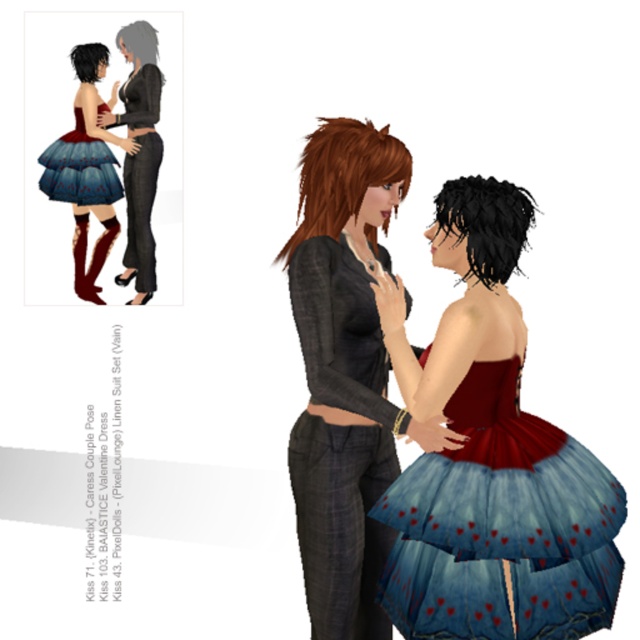
Question: From the image, what is the correct spatial relationship of blue tulle skirt with red hearts at lower right in relation to matte black dress at left?

Choices:
 (A) right
 (B) left

Answer: (A)

Question: Which object is positioned closest to the matte black dress at left?

Choices:
 (A) matte black dress at center
 (B) denim tulle dress at lower left
 (C) blue tulle skirt with red hearts at lower right

Answer: (B)

Question: In this image, where is matte blue tulle skirt at center located relative to denim tulle dress at lower left?

Choices:
 (A) above
 (B) below

Answer: (B)

Question: Among these objects, which one is farthest from the camera?

Choices:
 (A) blue tulle skirt with red hearts at lower right
 (B) denim tulle dress at lower left
 (C) matte blue tulle skirt at center

Answer: (B)

Question: Among these objects, which one is nearest to the camera?

Choices:
 (A) blue tulle skirt with red hearts at lower right
 (B) matte black dress at left
 (C) denim tulle dress at lower left
 (D) matte blue tulle skirt at center

Answer: (A)

Question: Is matte black dress at center thinner than matte blue tulle skirt at center?

Choices:
 (A) yes
 (B) no

Answer: (B)